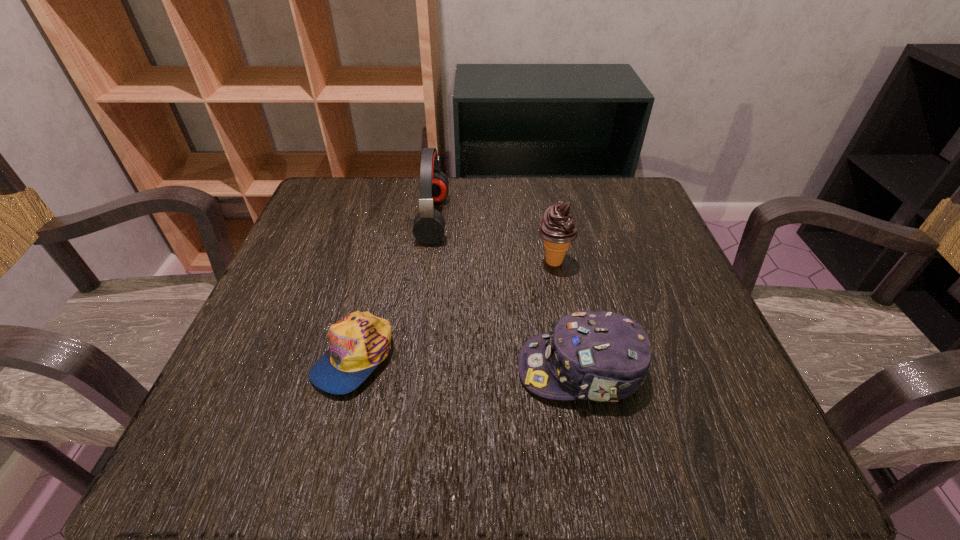
The width and height of the screenshot is (960, 540). I want to click on the third object from right to left, so click(x=429, y=224).

I want to click on the farthest object, so (429, 224).

Locate an element on the screen. The height and width of the screenshot is (540, 960). icecream is located at coordinates (558, 229).

The width and height of the screenshot is (960, 540). I want to click on the right cap, so click(x=601, y=356).

Locate an element on the screen. This screenshot has height=540, width=960. the third tallest object is located at coordinates (601, 356).

Where is `the shortest object`? the shortest object is located at coordinates (360, 341).

At what (x,y) coordinates should I click in order to perform the action: click on the shorter cap. Please return your answer as a coordinate pair (x, y). The image size is (960, 540). Looking at the image, I should click on (360, 341).

At what (x,y) coordinates should I click in order to perform the action: click on free space located 0.240m on the ear cups of the farthest object. Please return your answer as a coordinate pair (x, y). Image resolution: width=960 pixels, height=540 pixels. Looking at the image, I should click on (554, 219).

Where is `free spot located on the front of the icecream`? This screenshot has width=960, height=540. free spot located on the front of the icecream is located at coordinates (564, 312).

Where is `vacant space situated 0.130m on the front-facing side of the right cap`? The image size is (960, 540). vacant space situated 0.130m on the front-facing side of the right cap is located at coordinates click(436, 369).